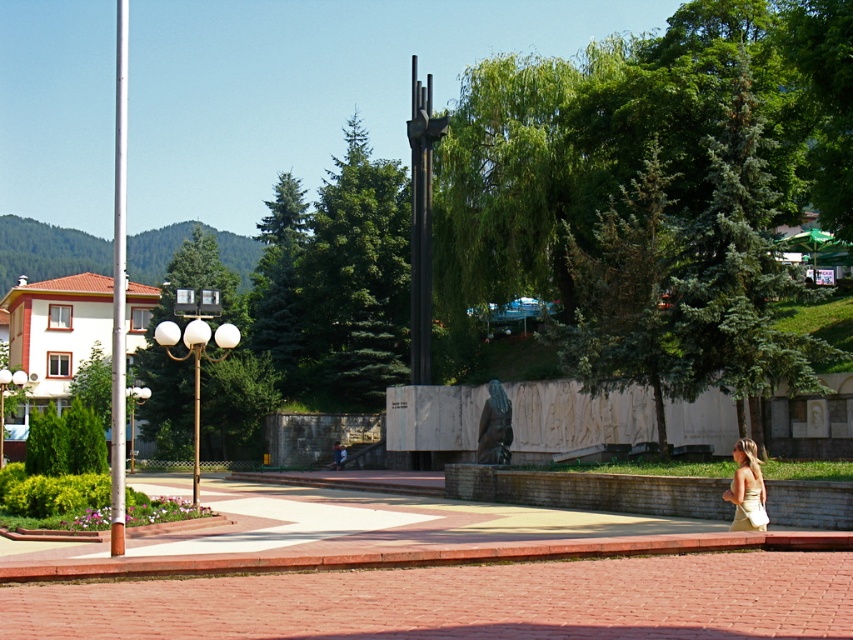
You are standing in the park and want to place a small bench between the two points, point (763, 524) and point (734, 524). Since the bench is 0.02 meters wide, will it fit between them?

The distance between point (763, 524) and point (734, 524) is 0.03 meters. Since the bench is 0.02 meters wide, it will fit between them.

You are a photographer setting up a tripod in the park. You need to position it so that both the polished silver pole at left and the light beige dress at lower right are visible in the frame. Given their sizes, which object should you ensure is closer to the camera to avoid it being too small in the photo?

The light beige dress at lower right is smaller than the polished silver pole at left. To ensure it appears large enough in the photo, you should position it closer to the camera.